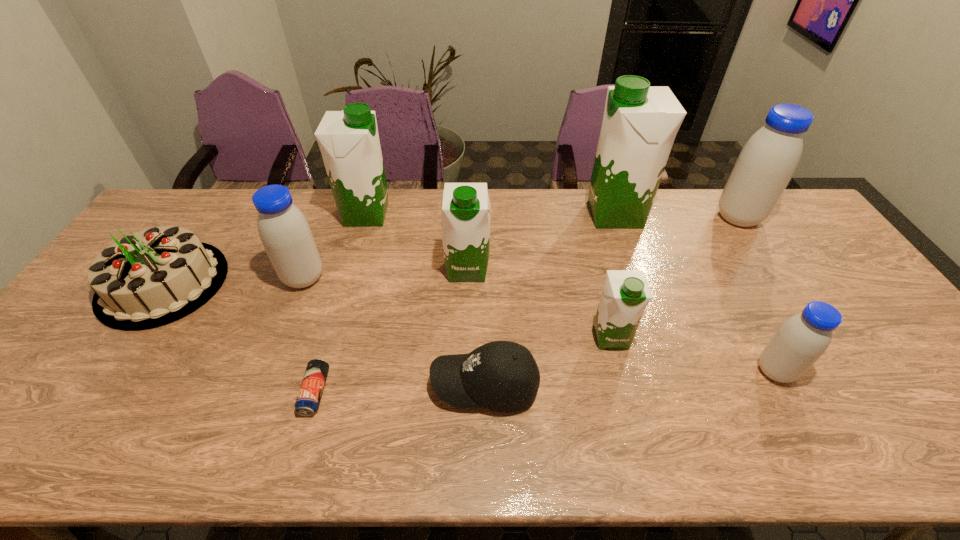
At what (x,y) coordinates should I click in order to perform the action: click on green birthday cake. Please return your answer as a coordinate pair (x, y). Looking at the image, I should click on (151, 278).

This screenshot has height=540, width=960. I want to click on the second object from right to left, so click(x=800, y=341).

Find the location of a particular element. This screenshot has width=960, height=540. the sixth soya milk from left to right is located at coordinates (800, 341).

Where is `the smallest green soya milk`? the smallest green soya milk is located at coordinates (626, 293).

Locate an element on the screen. The width and height of the screenshot is (960, 540). the sixth farthest soya milk is located at coordinates (626, 293).

Identify the location of the ninth tallest object. (502, 376).

The height and width of the screenshot is (540, 960). What are the coordinates of `black baseball cap` in the screenshot? It's located at (502, 376).

The height and width of the screenshot is (540, 960). In order to click on blue beer can in this screenshot , I will do `click(310, 392)`.

This screenshot has height=540, width=960. Find the location of `the shortest object`. the shortest object is located at coordinates (310, 392).

This screenshot has height=540, width=960. Find the location of `vacant space situated 0.400m on the front-facing side of the biggest green soya milk`. vacant space situated 0.400m on the front-facing side of the biggest green soya milk is located at coordinates (468, 214).